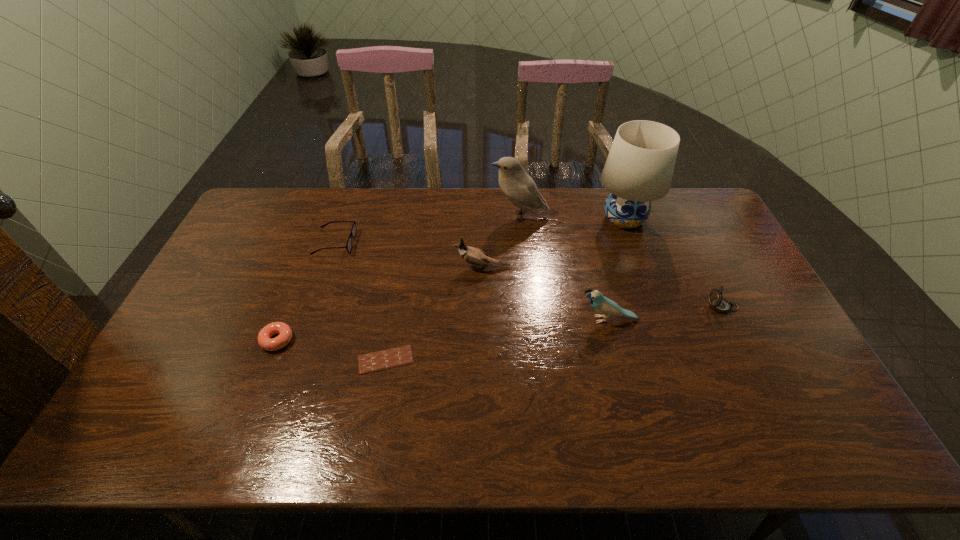
Locate an element on the screen. The width and height of the screenshot is (960, 540). vacant space situated at the face of the nearest bird is located at coordinates (553, 320).

The height and width of the screenshot is (540, 960). Find the location of `free space located on the face of the compass`. free space located on the face of the compass is located at coordinates (646, 307).

At what (x,y) coordinates should I click in order to perform the action: click on vacant region located on the face of the compass. Please return your answer as a coordinate pair (x, y). This screenshot has height=540, width=960. Looking at the image, I should click on (571, 307).

Locate an element on the screen. This screenshot has width=960, height=540. blank space located on the face of the compass is located at coordinates (663, 307).

At what (x,y) coordinates should I click in order to perform the action: click on free space located 0.110m on the front-facing side of the sixth tallest object. Please return your answer as a coordinate pair (x, y). The width and height of the screenshot is (960, 540). Looking at the image, I should click on (387, 242).

At what (x,y) coordinates should I click in order to perform the action: click on vacant space located 0.120m on the left of the doughnut. Please return your answer as a coordinate pair (x, y). Looking at the image, I should click on (218, 340).

Locate an element on the screen. The image size is (960, 540). free point located on the right of the shortest object is located at coordinates (433, 360).

This screenshot has height=540, width=960. Identify the location of lampshade that is at the far edge. (639, 168).

Identify the location of bird positioned at the far edge. The width and height of the screenshot is (960, 540). (521, 190).

Find the location of `spectacles that is at the far edge`. spectacles that is at the far edge is located at coordinates (353, 231).